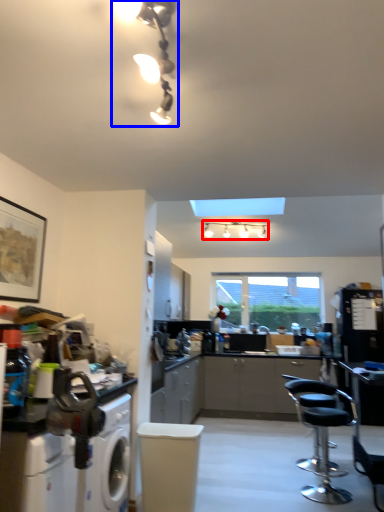
Question: Which object appears closest to the camera in this image, lamp (highlighted by a red box) or light fixture (highlighted by a blue box)?

Choices:
 (A) lamp
 (B) light fixture

Answer: (B)